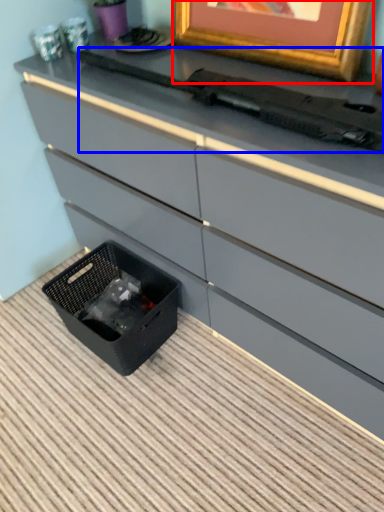
Question: Which of the following is the farthest to the observer, picture frame (highlighted by a red box) or typewriter (highlighted by a blue box)?

Choices:
 (A) picture frame
 (B) typewriter

Answer: (A)